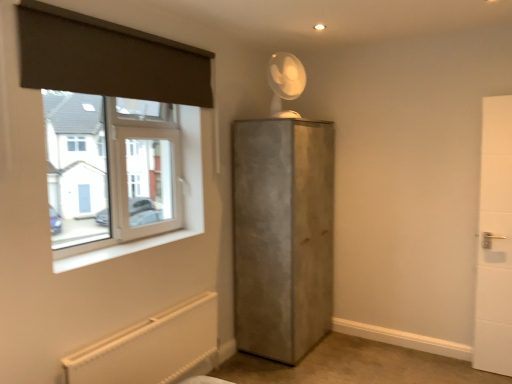
Question: From the image's perspective, is concrete cabinet at center, acting as the first door starting from the left, beneath white textured radiator at lower left?

Choices:
 (A) yes
 (B) no

Answer: (B)

Question: From the image's perspective, is concrete cabinet at center, which is counted as the second door, starting from the right, located above white textured radiator at lower left?

Choices:
 (A) no
 (B) yes

Answer: (B)

Question: Can you confirm if concrete cabinet at center, acting as the first door starting from the left, is positioned to the left of white textured radiator at lower left?

Choices:
 (A) yes
 (B) no

Answer: (B)

Question: Does concrete cabinet at center, which is counted as the second door, starting from the right, have a greater height compared to white textured radiator at lower left?

Choices:
 (A) no
 (B) yes

Answer: (B)

Question: Considering the relative sizes of concrete cabinet at center, acting as the first door starting from the left, and white textured radiator at lower left in the image provided, is concrete cabinet at center, acting as the first door starting from the left, thinner than white textured radiator at lower left?

Choices:
 (A) yes
 (B) no

Answer: (B)

Question: Is concrete cabinet at center, which is counted as the second door, starting from the right, positioned with its back to white textured radiator at lower left?

Choices:
 (A) no
 (B) yes

Answer: (A)

Question: Does dark gray fabric at upper left have a larger size compared to white tile door at right, which is the 1th door in right-to-left order?

Choices:
 (A) yes
 (B) no

Answer: (B)

Question: Is white tile door at right, which is the 2th door from left to right, located within dark gray fabric at upper left?

Choices:
 (A) no
 (B) yes

Answer: (A)

Question: Is dark gray fabric at upper left aimed at white tile door at right, which is the 2th door from left to right?

Choices:
 (A) no
 (B) yes

Answer: (A)

Question: Is dark gray fabric at upper left thinner than white tile door at right, which is the 1th door in right-to-left order?

Choices:
 (A) yes
 (B) no

Answer: (A)

Question: From a real-world perspective, does dark gray fabric at upper left stand above white tile door at right, which is the 2th door from left to right?

Choices:
 (A) yes
 (B) no

Answer: (A)

Question: Is dark gray fabric at upper left not near white tile door at right, which is the 2th door from left to right?

Choices:
 (A) no
 (B) yes

Answer: (B)

Question: Is dark gray fabric at upper left placed right next to white plastic window at upper left?

Choices:
 (A) yes
 (B) no

Answer: (B)